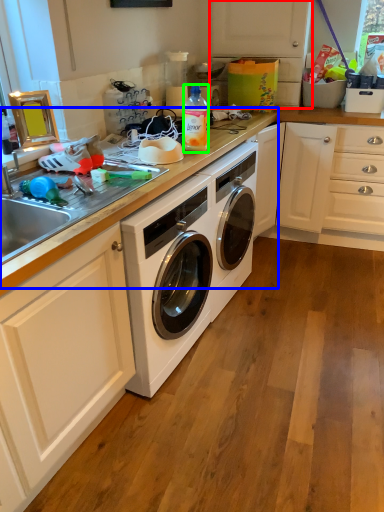
Question: Which is farther away from cabinetry (highlighted by a red box)? counter top (highlighted by a blue box) or bottle (highlighted by a green box)?

Choices:
 (A) counter top
 (B) bottle

Answer: (B)